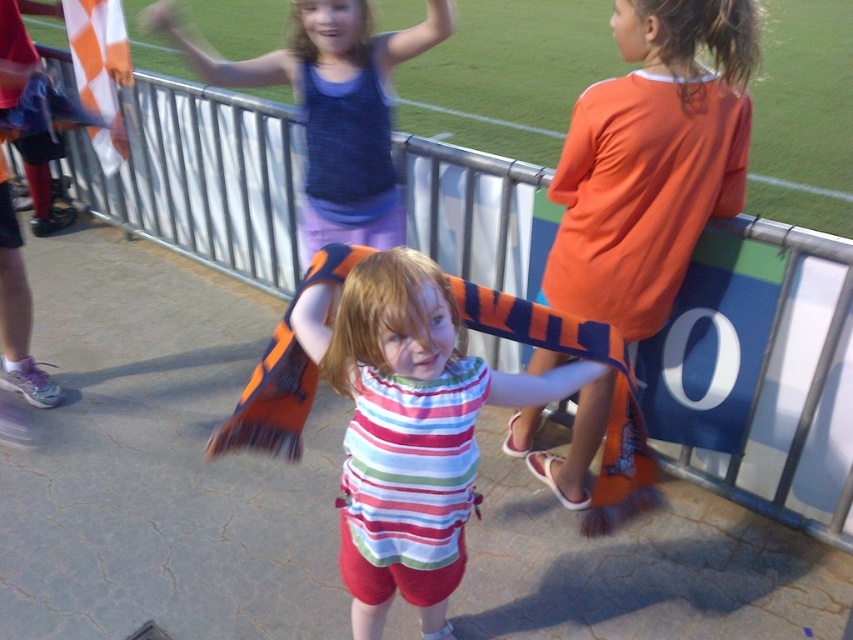
Does orange jersey at upper right appear on the right side of matte blue tank top at upper center?

Yes, orange jersey at upper right is to the right of matte blue tank top at upper center.

Is point (590, 250) farther from viewer compared to point (351, 58)?

No.

You are a GUI agent. You are given a task and a screenshot of the screen. Output one action in this format:
    pyautogui.click(x=<x>, y=<y>)
    Task: Click on the orange jersey at upper right
    
    Given the screenshot: What is the action you would take?
    pyautogui.click(x=651, y=161)

Between orange jersey at upper right and striped cotton shirt at center, which one is positioned higher?

orange jersey at upper right is above.

Which is in front, point (595, 163) or point (421, 364)?

Point (421, 364)

This screenshot has width=853, height=640. I want to click on orange jersey at upper right, so click(x=651, y=161).

Does striped cotton shirt at center have a larger size compared to matte blue tank top at upper center?

Incorrect, striped cotton shirt at center is not larger than matte blue tank top at upper center.

Is point (325, 324) farther from viewer compared to point (363, 68)?

No.

Identify the location of striped cotton shirt at center. The image size is (853, 640). (408, 428).